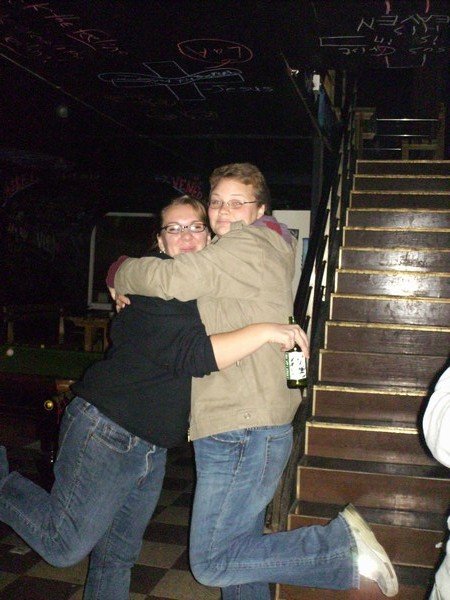
Locate an element on the screen. beer bottle is located at coordinates (300, 373).